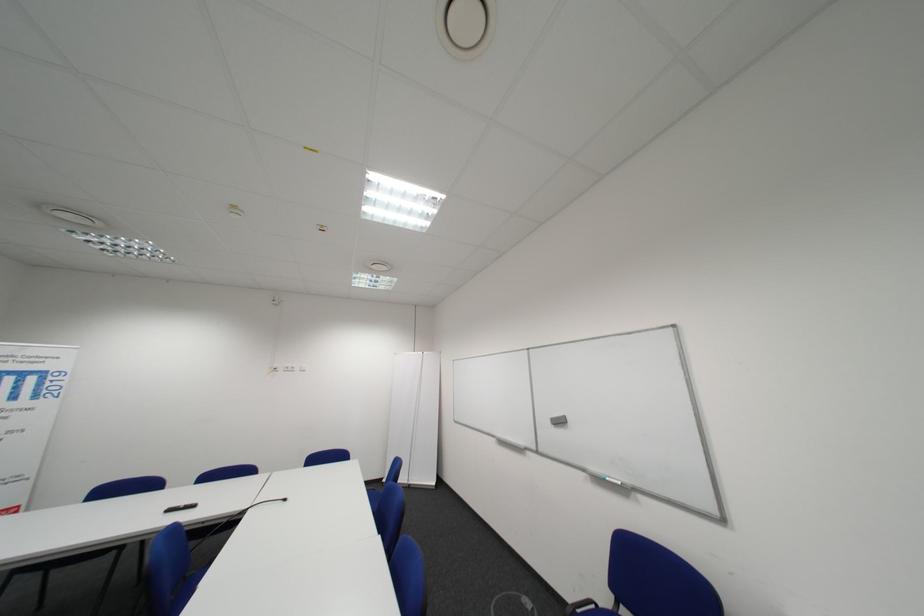
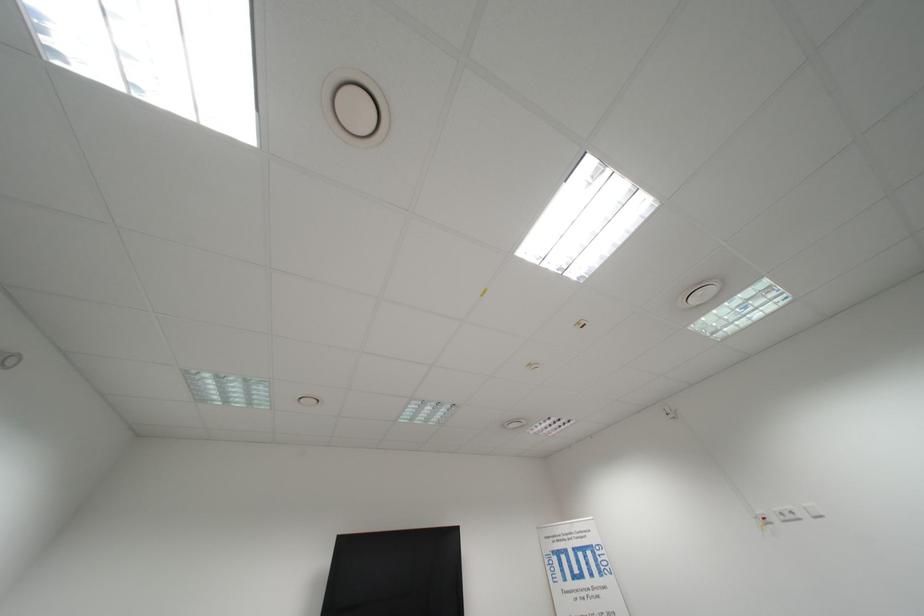
Where in the second image is the point corresponding to point 312,368 from the first image?

(818, 509)